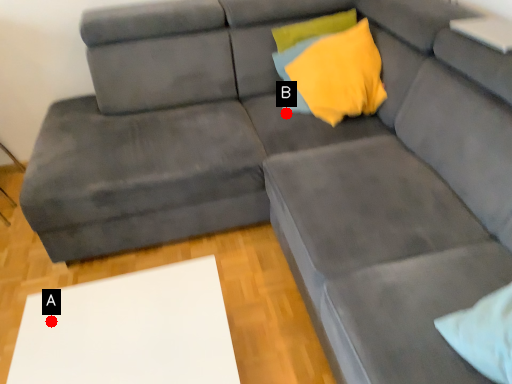
Question: Two points are circled on the image, labeled by A and B beside each circle. Which point is further to the camera?

Choices:
 (A) A is further
 (B) B is further

Answer: (B)